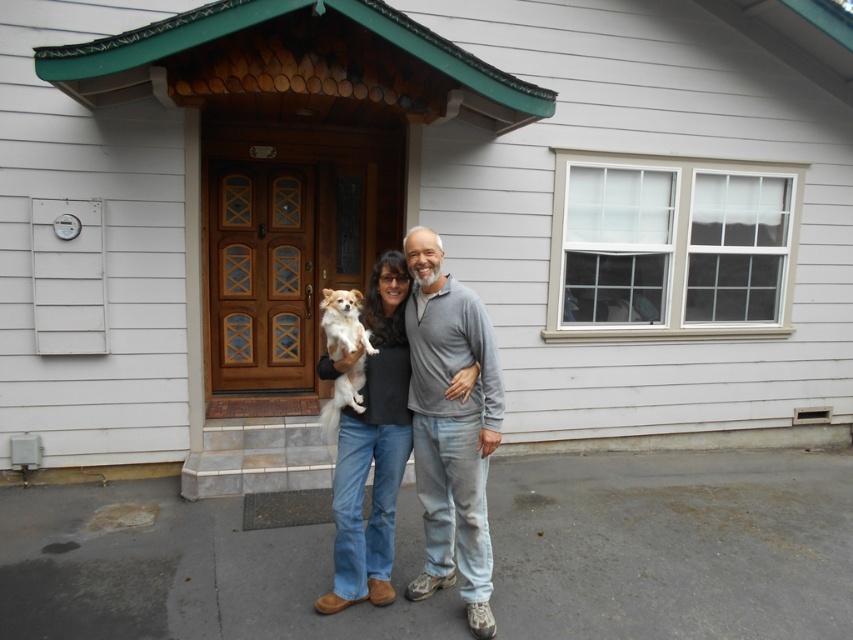
You are a photographer trying to capture a photo of the matte black shirt at center and the fluffy white dog at center. Which object should you focus on first if you want to ensure both are in focus, considering their heights?

The matte black shirt at center is taller than the fluffy white dog at center, so you should focus on the taller object first to ensure both are in focus.

You are trying to decide which item to grab quickly in case of an emergency. The gray cotton sweater at center and the fluffy white dog at center are both in the center of the image. Which one is bigger and easier to grab?

The gray cotton sweater at center has a larger size compared to the fluffy white dog at center, so it is bigger and easier to grab.